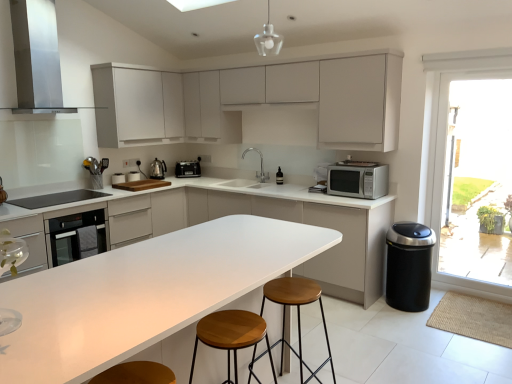
The height and width of the screenshot is (384, 512). In order to click on empty space that is ontop of wooden stool at center, arranged as the second stool when viewed from the back (from a real-world perspective) in this screenshot , I will do `click(233, 324)`.